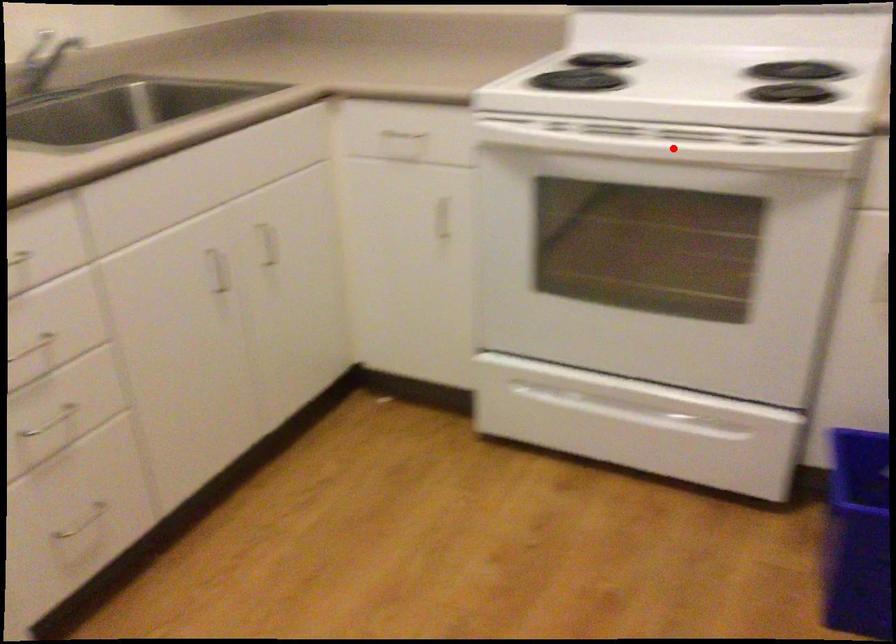
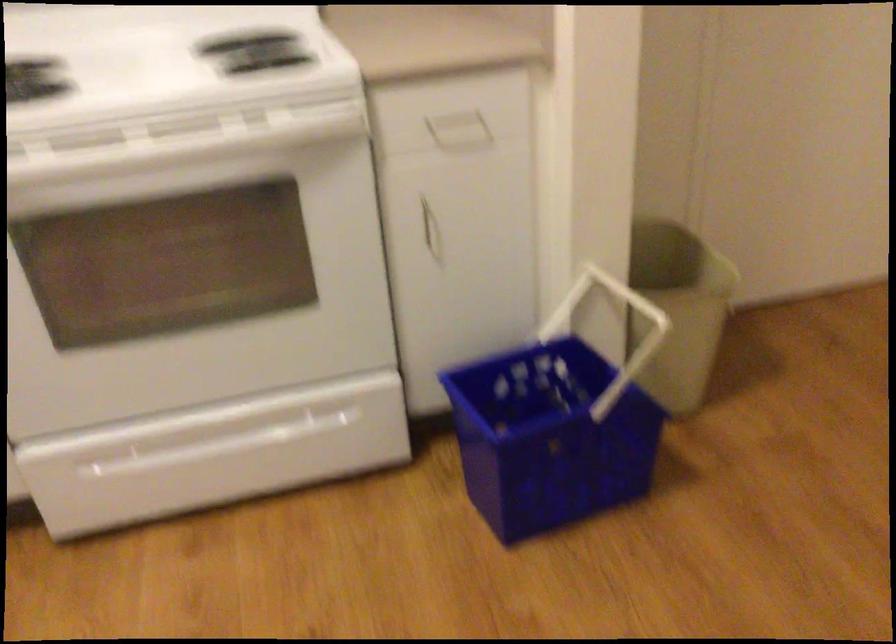
In the second image, find the point that corresponds to the highlighted location in the first image.

(175, 143)